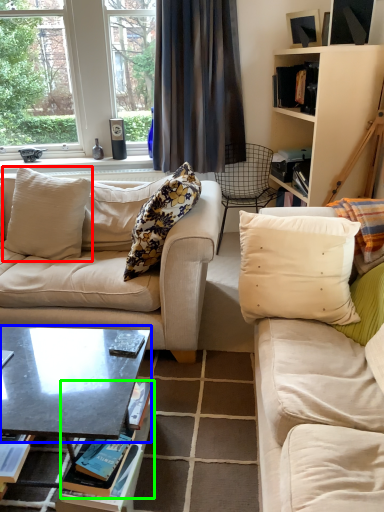
Question: Considering the real-world distances, which object is farthest from pillow (highlighted by a red box)? coffee table (highlighted by a blue box) or book (highlighted by a green box)?

Choices:
 (A) coffee table
 (B) book

Answer: (B)